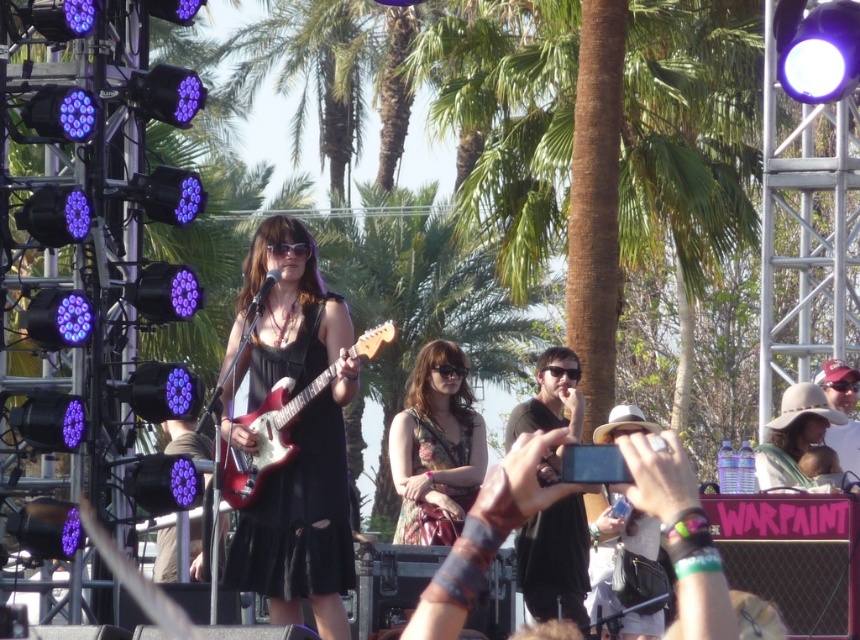
Question: Does white fabric hat at lower right appear on the right side of matte white hat at upper right?

Choices:
 (A) no
 (B) yes

Answer: (A)

Question: Which object is the closest to the black matte dress at center?

Choices:
 (A) white fabric hat at lower right
 (B) beige fabric hat at lower right
 (C) matte white hat at upper right

Answer: (A)

Question: Can you confirm if black matte dress at center is positioned to the right of black matte shirt at center?

Choices:
 (A) yes
 (B) no

Answer: (B)

Question: Does floral dress at center appear on the right side of shiny red electric guitar at center?

Choices:
 (A) yes
 (B) no

Answer: (A)

Question: Which object is the farthest from the black matte shirt at center?

Choices:
 (A) matte white hat at upper right
 (B) beige fabric hat at lower right

Answer: (A)

Question: Which of the following is the closest to the observer?

Choices:
 (A) (858, 467)
 (B) (378, 340)

Answer: (B)